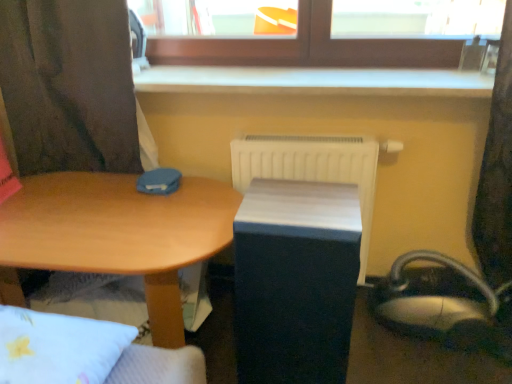
Where is `metallic silver swivel chair at lower right`? The height and width of the screenshot is (384, 512). metallic silver swivel chair at lower right is located at coordinates (440, 305).

What is the approximate height of transparent glass window at upper center?

transparent glass window at upper center is 10.07 inches in height.

Find the location of `matte black changing table at center`. matte black changing table at center is located at coordinates (295, 281).

Locate an element on the screen. The width and height of the screenshot is (512, 384). wooden desk at center is located at coordinates (119, 233).

You are a GUI agent. You are given a task and a screenshot of the screen. Output one action in this format:
    pyautogui.click(x=<x>, y=<y>)
    Task: Click on the white plastic radiator at center
    The width and height of the screenshot is (512, 384).
    Given the screenshot: What is the action you would take?
    312,168

Is matte black changing table at center at the right side of white plastic radiator at center?

No.

Does matte black changing table at center have a lesser width compared to white plastic radiator at center?

No.

Which is in front, matte black changing table at center or white plastic radiator at center?

matte black changing table at center is in front.

The width and height of the screenshot is (512, 384). Find the location of `radiator above the matte black changing table at center (from a real-world perspective)`. radiator above the matte black changing table at center (from a real-world perspective) is located at coordinates (312, 168).

Are transparent glass window at upper center and matte black changing table at center beside each other?

No, transparent glass window at upper center is not in contact with matte black changing table at center.

Considering the positions of point (202, 32) and point (274, 361), is point (202, 32) closer or farther from the camera than point (274, 361)?

Clearly, point (202, 32) is more distant from the camera than point (274, 361).

From a real-world perspective, is transparent glass window at upper center on matte black changing table at center?

Indeed, from a real-world perspective, transparent glass window at upper center stands above matte black changing table at center.

Is metallic silver swivel chair at lower right spatially inside wooden desk at center, or outside of it?

metallic silver swivel chair at lower right cannot be found inside wooden desk at center.

Who is taller, metallic silver swivel chair at lower right or wooden desk at center?

wooden desk at center is taller.

Where is `swivel chair that appears behind the wooden desk at center`? swivel chair that appears behind the wooden desk at center is located at coordinates click(x=440, y=305).

Is point (347, 171) farther from camera compared to point (85, 202)?

Yes, point (347, 171) is behind point (85, 202).

Does white plastic radiator at center come in front of wooden desk at center?

No.

Can you confirm if white plastic radiator at center is thinner than wooden desk at center?

Yes.

Looking at this image, considering the positions of objects white plastic radiator at center and wooden desk at center in the image provided, who is more to the right, white plastic radiator at center or wooden desk at center?

white plastic radiator at center.

Considering the sizes of metallic silver swivel chair at lower right and white plastic radiator at center in the image, is metallic silver swivel chair at lower right taller or shorter than white plastic radiator at center?

metallic silver swivel chair at lower right is shorter than white plastic radiator at center.

Can you confirm if metallic silver swivel chair at lower right is bigger than white plastic radiator at center?

Indeed, metallic silver swivel chair at lower right has a larger size compared to white plastic radiator at center.

Can you confirm if metallic silver swivel chair at lower right is thinner than white plastic radiator at center?

No, metallic silver swivel chair at lower right is not thinner than white plastic radiator at center.

Is metallic silver swivel chair at lower right turned away from white plastic radiator at center?

No, metallic silver swivel chair at lower right is not facing away from white plastic radiator at center.

Is matte black changing table at center facing towards metallic silver swivel chair at lower right?

No, matte black changing table at center is not aimed at metallic silver swivel chair at lower right.

Is matte black changing table at center far from metallic silver swivel chair at lower right?

matte black changing table at center is actually quite close to metallic silver swivel chair at lower right.

Locate an element on the screen. The width and height of the screenshot is (512, 384). swivel chair that is on the right side of matte black changing table at center is located at coordinates (440, 305).

From the image's perspective, does wooden desk at center appear lower than white plastic radiator at center?

Indeed, from the image's perspective, wooden desk at center is shown beneath white plastic radiator at center.

Considering the relative positions of wooden desk at center and white plastic radiator at center in the image provided, is wooden desk at center behind white plastic radiator at center?

No, it is in front of white plastic radiator at center.

Based on their sizes in the image, would you say wooden desk at center is bigger or smaller than white plastic radiator at center?

In the image, wooden desk at center appears to be larger than white plastic radiator at center.

Where is `radiator that appears on the right of matte black changing table at center`? This screenshot has width=512, height=384. radiator that appears on the right of matte black changing table at center is located at coordinates (312, 168).

At what (x,y) coordinates should I click in order to perform the action: click on changing table below the transparent glass window at upper center (from a real-world perspective). Please return your answer as a coordinate pair (x, y). Looking at the image, I should click on (295, 281).

From the image, which object appears to be farther from transparent glass window at upper center, wooden desk at center or white plastic radiator at center?

wooden desk at center lies further to transparent glass window at upper center than the other object.

Estimate the real-world distances between objects in this image. Which object is further from matte black changing table at center, wooden desk at center or metallic silver swivel chair at lower right?

metallic silver swivel chair at lower right is further to matte black changing table at center.

From the image, which object appears to be farther from transparent glass window at upper center, metallic silver swivel chair at lower right or matte black changing table at center?

The object further to transparent glass window at upper center is metallic silver swivel chair at lower right.

Looking at the image, which one is located further to wooden desk at center, transparent glass window at upper center or metallic silver swivel chair at lower right?

metallic silver swivel chair at lower right lies further to wooden desk at center than the other object.

Looking at the image, which one is located further to white plastic radiator at center, metallic silver swivel chair at lower right or wooden desk at center?

wooden desk at center lies further to white plastic radiator at center than the other object.

From the picture: Looking at the image, which one is located further to metallic silver swivel chair at lower right, transparent glass window at upper center or wooden desk at center?

The object further to metallic silver swivel chair at lower right is wooden desk at center.

Considering their positions, is transparent glass window at upper center positioned closer to white plastic radiator at center than metallic silver swivel chair at lower right?

The object closer to white plastic radiator at center is metallic silver swivel chair at lower right.

From the image, which object appears to be nearer to white plastic radiator at center, transparent glass window at upper center or matte black changing table at center?

matte black changing table at center is positioned closer to the anchor white plastic radiator at center.

Identify the location of changing table located between wooden desk at center and metallic silver swivel chair at lower right in the left-right direction. (295, 281).

Identify the location of desk between transparent glass window at upper center and matte black changing table at center vertically. The height and width of the screenshot is (384, 512). (119, 233).

At what (x,y) coordinates should I click in order to perform the action: click on window between wooden desk at center and metallic silver swivel chair at lower right in the horizontal direction. Please return your answer as a coordinate pair (x, y). Image resolution: width=512 pixels, height=384 pixels. Looking at the image, I should click on (316, 31).

Identify the location of radiator between transparent glass window at upper center and wooden desk at center from top to bottom. tap(312, 168).